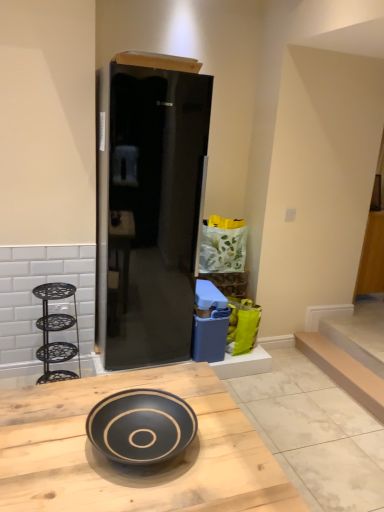
The image size is (384, 512). In order to click on blank space above smooth beige stair at lower right (from a real-world perspective) in this screenshot , I will do `click(355, 357)`.